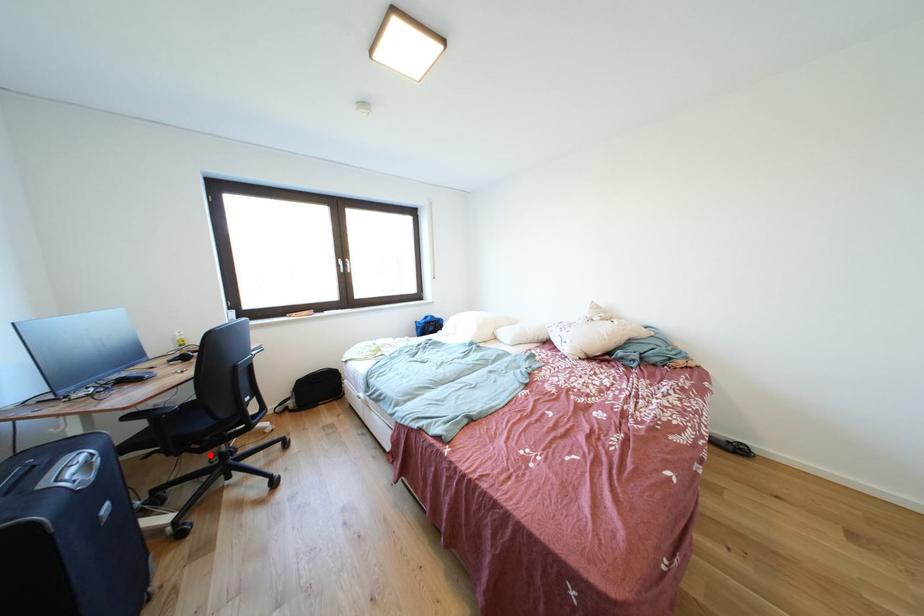
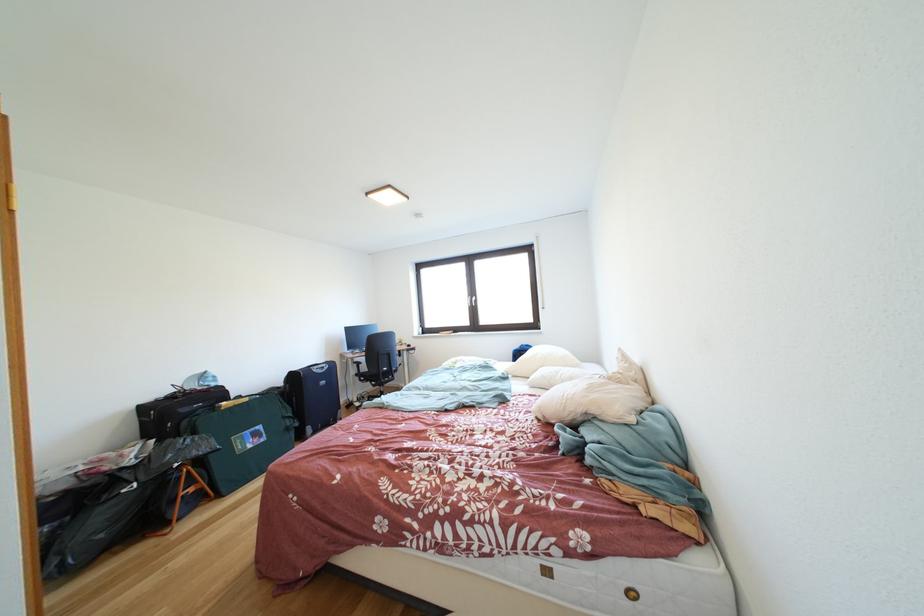
Locate, in the second image, the point that corresponds to the highlighted location in the first image.

(383, 391)